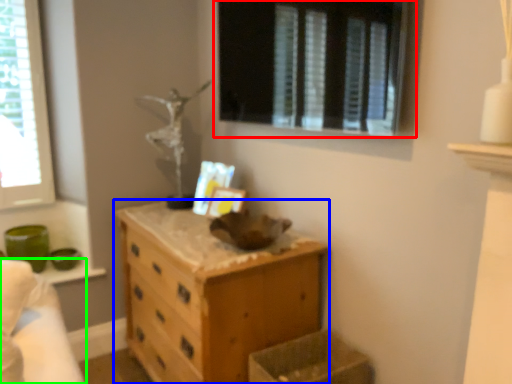
Question: Estimate the real-world distances between objects in this image. Which object is farther from window (highlighted by a red box), chest of drawers (highlighted by a blue box) or bed (highlighted by a green box)?

Choices:
 (A) chest of drawers
 (B) bed

Answer: (B)